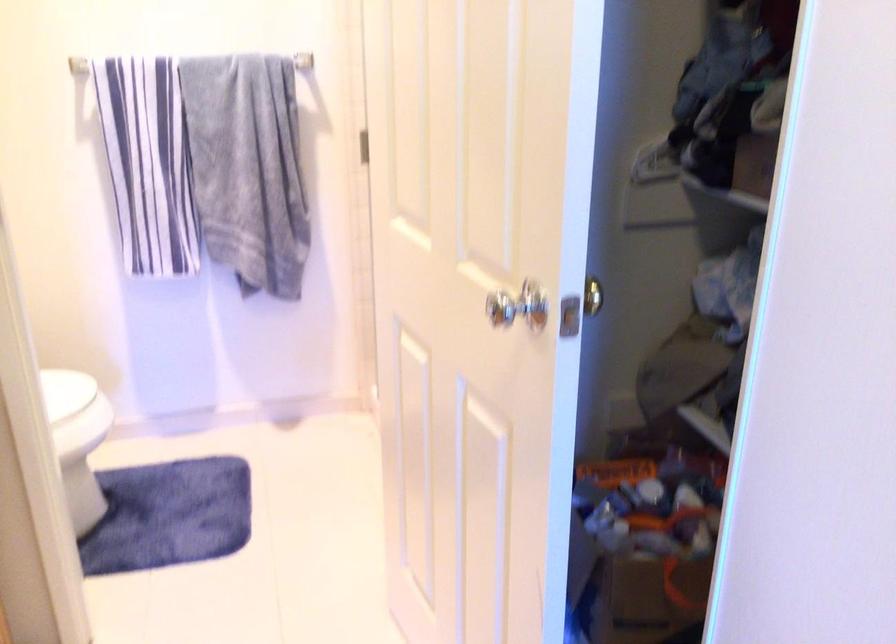
Identify the location of white toilet lid. (72, 400).